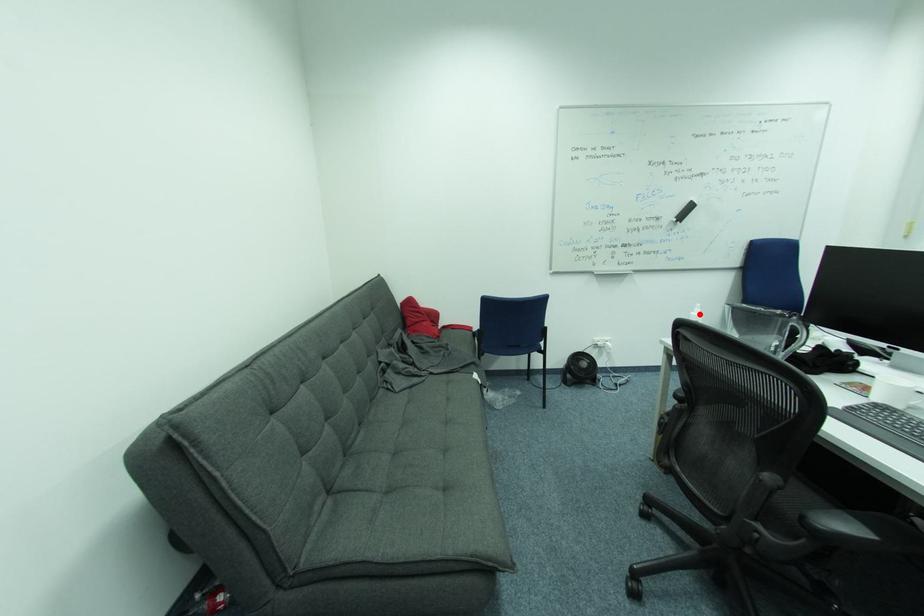
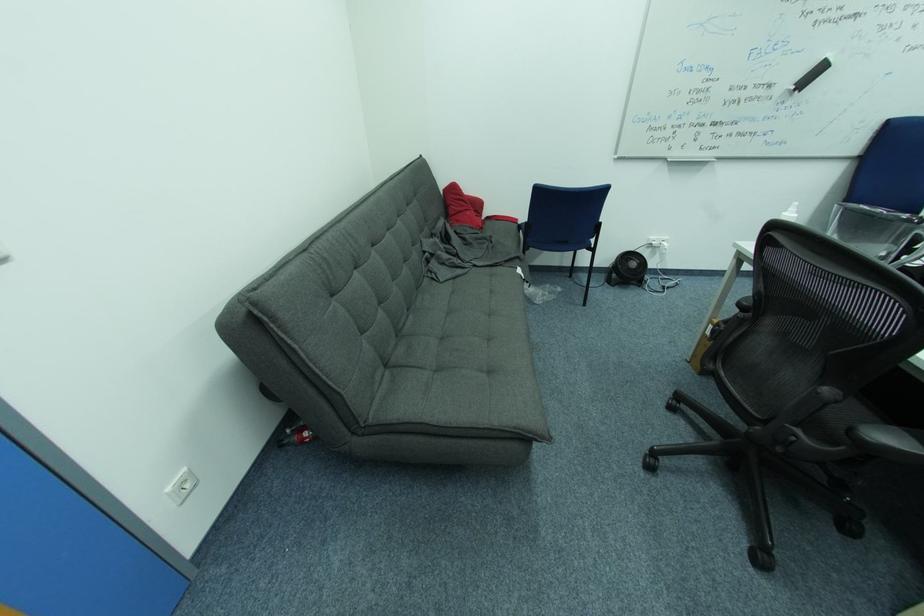
Question: I am providing you with two images of the same scene from different viewpoints. A red point is marked on the first image. Can you still see the location of the red point in image 2?

Choices:
 (A) Yes
 (B) No

Answer: (A)